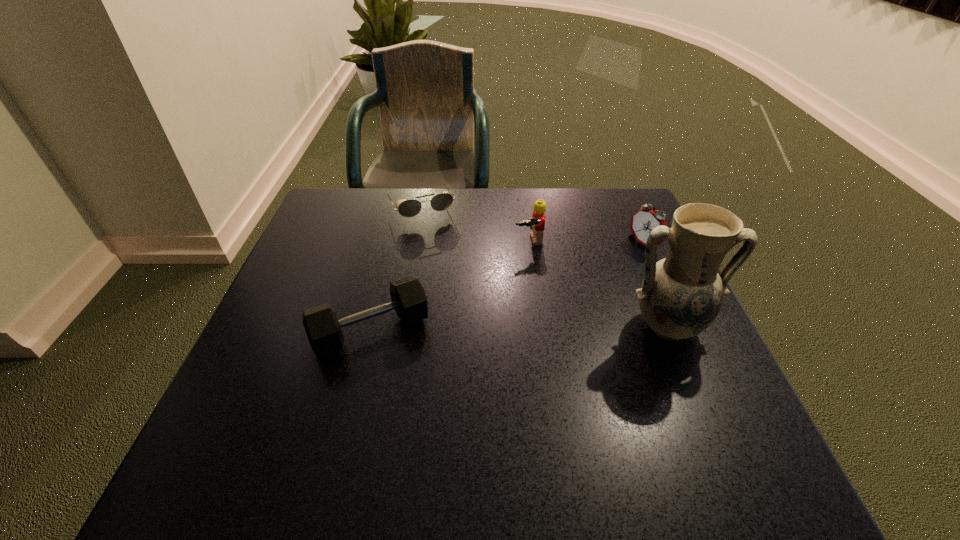
Image resolution: width=960 pixels, height=540 pixels. Find the location of `object that is the third closest to the dumbbell`. object that is the third closest to the dumbbell is located at coordinates click(x=681, y=295).